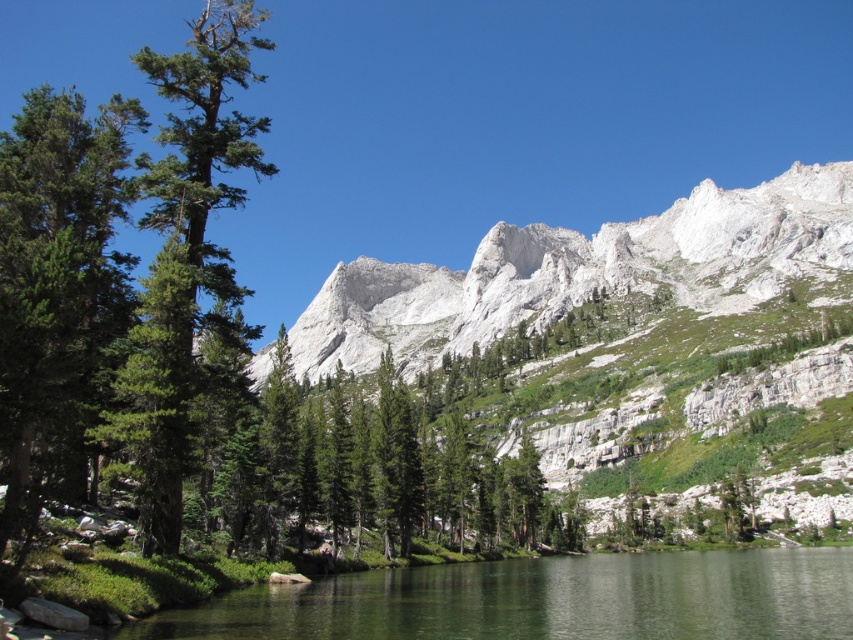
Between clear water at center and green textured pine tree at left, which one is positioned lower?

clear water at center

Locate an element on the screen. The image size is (853, 640). clear water at center is located at coordinates (546, 600).

Locate an element on the screen. clear water at center is located at coordinates (546, 600).

Can you confirm if clear water at center is positioned below green matte tree at left?

Yes, clear water at center is below green matte tree at left.

Is point (688, 605) positioned behind point (68, 378)?

Yes, point (688, 605) is behind point (68, 378).

Find the location of a particular element. clear water at center is located at coordinates (546, 600).

Can you confirm if white rocky mountain at upper center is wider than clear water at center?

Correct, the width of white rocky mountain at upper center exceeds that of clear water at center.

Can you confirm if white rocky mountain at upper center is bigger than clear water at center?

Correct, white rocky mountain at upper center is larger in size than clear water at center.

Is point (621, 237) positioned before point (569, 605)?

That is False.

You are a GUI agent. You are given a task and a screenshot of the screen. Output one action in this format:
    pyautogui.click(x=<x>, y=<y>)
    Task: Click on the white rocky mountain at upper center
    The image size is (853, 640).
    Given the screenshot: What is the action you would take?
    582,273